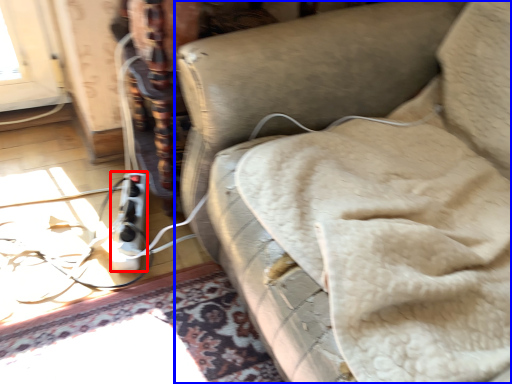
Question: Which object appears closest to the camera in this image, extension cord (highlighted by a red box) or furniture (highlighted by a blue box)?

Choices:
 (A) extension cord
 (B) furniture

Answer: (B)